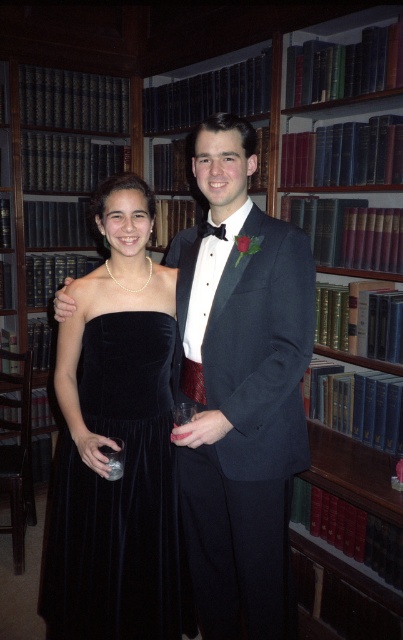
Between point (349, 368) and point (213, 228), which one is positioned in front?

Positioned in front is point (213, 228).

From the picture: Who is more forward, (332, 630) or (209, 234)?

Point (209, 234) is in front.

The image size is (403, 640). I want to click on hardcover books at center, so click(351, 540).

Can you confirm if velvet black dress at center is taller than hardcover books at center?

Correct, velvet black dress at center is much taller as hardcover books at center.

Does velvet black dress at center appear over hardcover books at center?

Actually, velvet black dress at center is below hardcover books at center.

Is point (105, 384) positioned after point (321, 268)?

That is False.

Where is `velvet black dress at center`? The image size is (403, 640). velvet black dress at center is located at coordinates (118, 497).

The height and width of the screenshot is (640, 403). Describe the element at coordinates (240, 392) in the screenshot. I see `shiny black suit at center` at that location.

Is point (280, 588) less distant than point (87, 250)?

That is True.

Locate an element on the screen. This screenshot has height=640, width=403. shiny black suit at center is located at coordinates (240, 392).